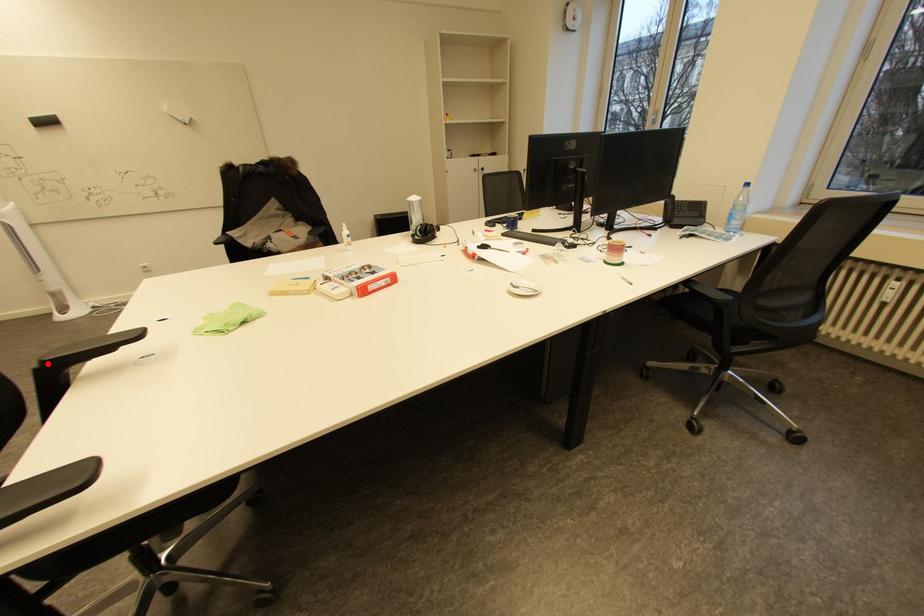
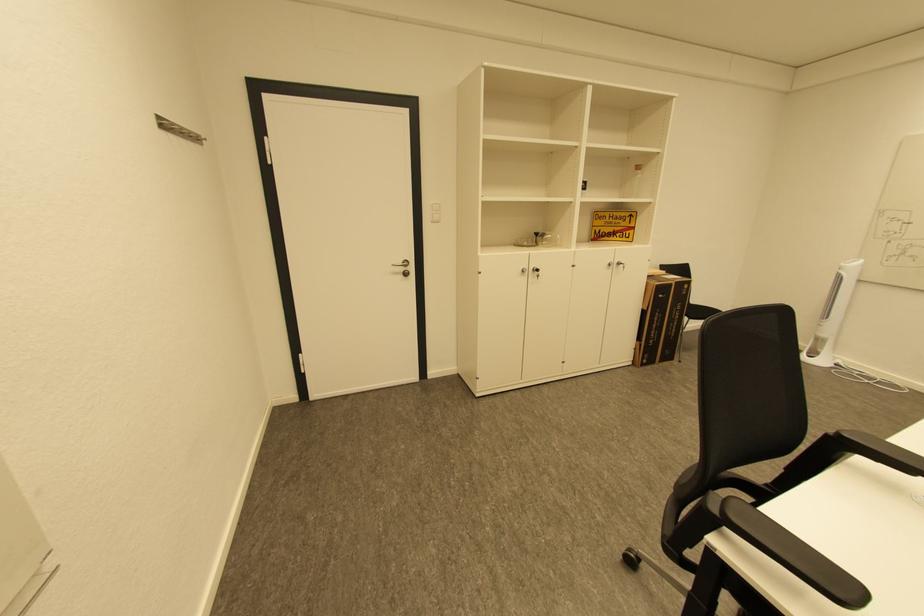
Where in the second image is the point corresponding to the highlighted location from the first image?

(845, 436)